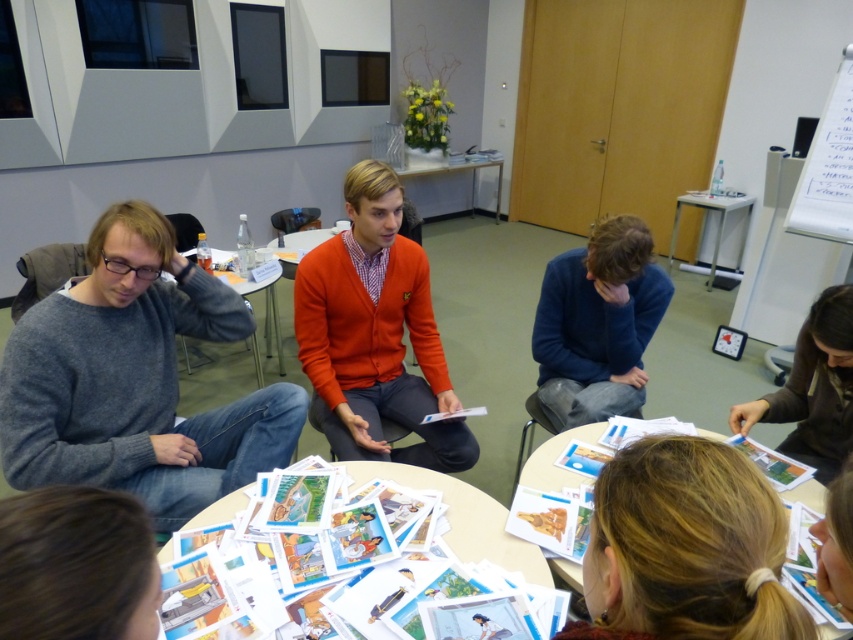
Question: Can you confirm if gray sweater at left is wider than matte gray table at center?

Choices:
 (A) no
 (B) yes

Answer: (B)

Question: Can you confirm if gray sweater at left is bigger than white paper at center?

Choices:
 (A) no
 (B) yes

Answer: (B)

Question: Which object appears farthest from the camera in this image?

Choices:
 (A) gray sweater at left
 (B) orange cardigan at center

Answer: (B)

Question: Is brown leather jacket at lower right smaller than metallic silver table at upper right?

Choices:
 (A) yes
 (B) no

Answer: (A)

Question: Among these objects, which one is farthest from the camera?

Choices:
 (A) blue sweater at center
 (B) orange cardigan at center
 (C) matte gray table at center

Answer: (C)

Question: Estimate the real-world distances between objects in this image. Which object is farther from the white paper at lower center?

Choices:
 (A) brown hair at lower left
 (B) white paper at center
 (C) white glossy table at upper center
 (D) brown leather jacket at lower right

Answer: (C)